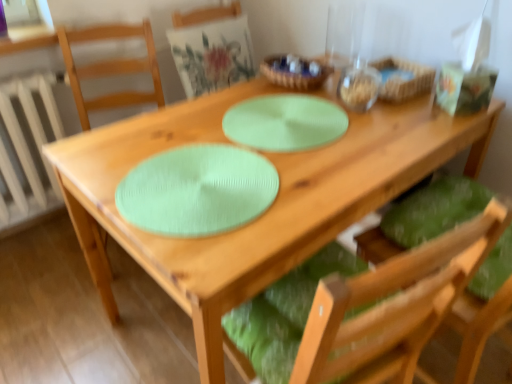
I want to click on matte green cushion at upper center, the 3th chair from the right, so click(x=212, y=55).

Identify the location of mint green textured placemat at center. The height and width of the screenshot is (384, 512). (197, 190).

Locate an element on the screen. The width and height of the screenshot is (512, 384). green fabric cushion at lower right, which appears as the first chair when viewed from the right is located at coordinates (434, 210).

Where is `green textured placemat at center`? green textured placemat at center is located at coordinates (284, 122).

Based on the photo, are woven wood basket at upper right and white painted metal radiator at left far apart?

Yes.

Is woven wood basket at upper right to the left of white painted metal radiator at left from the viewer's perspective?

In fact, woven wood basket at upper right is to the right of white painted metal radiator at left.

Is woven wood basket at upper right facing away from white painted metal radiator at left?

No, woven wood basket at upper right is not facing away from white painted metal radiator at left.

Does point (53, 104) come in front of point (210, 56)?

Yes, point (53, 104) is closer to viewer.

Considering the relative sizes of white painted metal radiator at left and matte green cushion at upper center, the 3th chair from the right, in the image provided, is white painted metal radiator at left taller than matte green cushion at upper center, the 3th chair from the right,?

Indeed, white painted metal radiator at left has a greater height compared to matte green cushion at upper center, the 3th chair from the right.

From a real-world perspective, which is physically below, white painted metal radiator at left or matte green cushion at upper center, the 1th chair positioned from the left?

From a 3D spatial view, white painted metal radiator at left is below.

Considering the relative sizes of green fabric cushion at center, the second chair when ordered from left to right, and green fabric cushion at lower right, which appears as the first chair when viewed from the right, in the image provided, is green fabric cushion at center, the second chair when ordered from left to right, bigger than green fabric cushion at lower right, which appears as the first chair when viewed from the right,?

Yes, green fabric cushion at center, the second chair when ordered from left to right, is bigger than green fabric cushion at lower right, which appears as the first chair when viewed from the right.

Considering the relative sizes of green fabric cushion at center, the second chair positioned from the right, and green fabric cushion at lower right, which appears as the first chair when viewed from the right, in the image provided, is green fabric cushion at center, the second chair positioned from the right, taller than green fabric cushion at lower right, which appears as the first chair when viewed from the right,?

Indeed, green fabric cushion at center, the second chair positioned from the right, has a greater height compared to green fabric cushion at lower right, which appears as the first chair when viewed from the right.

Consider the image. Measure the distance between green fabric cushion at center, the second chair when ordered from left to right, and green fabric cushion at lower right, which appears as the first chair when viewed from the right.

green fabric cushion at center, the second chair when ordered from left to right, is 15.41 inches from green fabric cushion at lower right, which appears as the first chair when viewed from the right.

From the picture: Is green fabric cushion at center, the second chair positioned from the right, to the left or to the right of green fabric cushion at lower right, which appears as the first chair when viewed from the right, in the image?

From the image, it's evident that green fabric cushion at center, the second chair positioned from the right, is to the left of green fabric cushion at lower right, which appears as the first chair when viewed from the right.

What's the angular difference between matte green cushion at upper center, the 1th chair positioned from the left, and woven wood basket at upper right's facing directions?

There is a 91.8-degree angle between the facing directions of matte green cushion at upper center, the 1th chair positioned from the left, and woven wood basket at upper right.

Could you tell me if matte green cushion at upper center, the 3th chair from the right, is facing woven wood basket at upper right?

Yes, matte green cushion at upper center, the 3th chair from the right, is turned towards woven wood basket at upper right.

Based on their positions, is matte green cushion at upper center, the 3th chair from the right, located to the left or right of woven wood basket at upper right?

In the image, matte green cushion at upper center, the 3th chair from the right, appears on the left side of woven wood basket at upper right.

Considering the sizes of objects matte green cushion at upper center, the 3th chair from the right, and woven wood basket at upper right in the image provided, who is taller, matte green cushion at upper center, the 3th chair from the right, or woven wood basket at upper right?

matte green cushion at upper center, the 3th chair from the right, is taller.

From the picture: From a real-world perspective, relative to wooden bowl at upper center, is matte green cushion at upper center, the 1th chair positioned from the left, vertically above or below?

matte green cushion at upper center, the 1th chair positioned from the left, is situated lower than wooden bowl at upper center in the real world.

Measure the distance from matte green cushion at upper center, the 3th chair from the right, to wooden bowl at upper center.

matte green cushion at upper center, the 3th chair from the right, and wooden bowl at upper center are 32.27 centimeters apart.

From the image's perspective, is matte green cushion at upper center, the 1th chair positioned from the left, below wooden bowl at upper center?

No, from the image's perspective, matte green cushion at upper center, the 1th chair positioned from the left, is not beneath wooden bowl at upper center.

Looking at this image, is wooden bowl at upper center a part of matte green cushion at upper center, the 3th chair from the right?

No, matte green cushion at upper center, the 3th chair from the right, does not contain wooden bowl at upper center.

Considering the relative sizes of mint green textured placemat at center and white painted metal radiator at left in the image provided, is mint green textured placemat at center thinner than white painted metal radiator at left?

Incorrect, the width of mint green textured placemat at center is not less than that of white painted metal radiator at left.

Is mint green textured placemat at center to the left of white painted metal radiator at left from the viewer's perspective?

No.

How distant is mint green textured placemat at center from white painted metal radiator at left?

The distance of mint green textured placemat at center from white painted metal radiator at left is 3.63 feet.

Can you tell me how much mint green textured placemat at center and white painted metal radiator at left differ in facing direction?

They differ by 1.5 degrees in their facing directions.

From the image's perspective, is white painted metal radiator at left under green textured placemat at center?

Yes.

From a real-world perspective, is white painted metal radiator at left positioned under green textured placemat at center based on gravity?

Indeed, from a real-world perspective, white painted metal radiator at left is positioned beneath green textured placemat at center.

Does white painted metal radiator at left touch green textured placemat at center?

white painted metal radiator at left and green textured placemat at center are not in contact.

Which of these two, white painted metal radiator at left or green textured placemat at center, is smaller?

green textured placemat at center is smaller.

The height and width of the screenshot is (384, 512). I want to click on basket to the right of white painted metal radiator at left, so click(x=403, y=79).

The image size is (512, 384). Find the location of `chair located above the white painted metal radiator at left (from the image's perspective)`. chair located above the white painted metal radiator at left (from the image's perspective) is located at coordinates (212, 55).

Looking at the image, which one is located further to green textured placemat at center, matte green cushion at upper center, the 1th chair positioned from the left, or green fabric cushion at center, the second chair positioned from the right?

matte green cushion at upper center, the 1th chair positioned from the left, is positioned further to the anchor green textured placemat at center.

Based on their spatial positions, is green fabric cushion at lower right, the 3th chair from the left, or wooden bowl at upper center closer to woven wood basket at upper right?

Among the two, wooden bowl at upper center is located nearer to woven wood basket at upper right.

Which object lies further to the anchor point green fabric cushion at lower right, which appears as the first chair when viewed from the right, green fabric cushion at center, the second chair positioned from the right, or green textured placemat at center?

Among the two, green textured placemat at center is located further to green fabric cushion at lower right, which appears as the first chair when viewed from the right.

When comparing their distances from green fabric cushion at lower right, the 3th chair from the left, does matte green cushion at upper center, the 3th chair from the right, or green textured placemat at center seem closer?

Among the two, green textured placemat at center is located nearer to green fabric cushion at lower right, the 3th chair from the left.

Looking at this image, estimate the real-world distances between objects in this image. Which object is further from green fabric cushion at center, the second chair positioned from the right, white painted metal radiator at left or green textured placemat at center?

white painted metal radiator at left is positioned further to the anchor green fabric cushion at center, the second chair positioned from the right.

Which object lies further to the anchor point white painted metal radiator at left, woven wood basket at upper right or mint green textured placemat at center?

woven wood basket at upper right.

From the image, which object appears to be nearer to wooden bowl at upper center, matte green cushion at upper center, the 1th chair positioned from the left, or mint green textured placemat at center?

Among the two, matte green cushion at upper center, the 1th chair positioned from the left, is located nearer to wooden bowl at upper center.

Based on their spatial positions, is mint green textured placemat at center or green textured placemat at center further from green fabric cushion at center, the second chair when ordered from left to right?

The object further to green fabric cushion at center, the second chair when ordered from left to right, is green textured placemat at center.

I want to click on tableware located between white painted metal radiator at left and green fabric cushion at lower right, the 3th chair from the left, in the left-right direction, so click(295, 71).

You are a GUI agent. You are given a task and a screenshot of the screen. Output one action in this format:
    pyautogui.click(x=<x>, y=<y>)
    Task: Click on the glass plate positioned between green fabric cushion at center, the second chair when ordered from left to right, and woven wood basket at upper right from near to far
    
    Given the screenshot: What is the action you would take?
    pyautogui.click(x=284, y=122)

Locate an element on the screen. The width and height of the screenshot is (512, 384). glass plate located between mint green textured placemat at center and woven wood basket at upper right in the left-right direction is located at coordinates (284, 122).

Locate an element on the screen. chair between green fabric cushion at center, the second chair when ordered from left to right, and wooden bowl at upper center, along the z-axis is located at coordinates (434, 210).